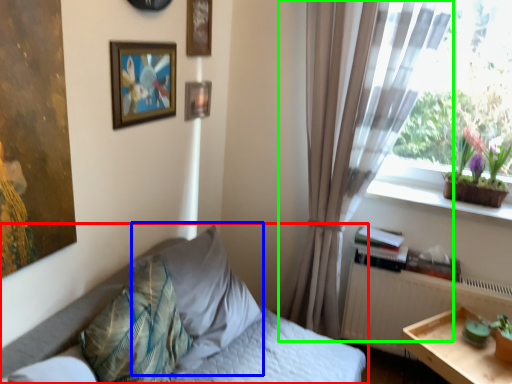
Question: Considering the real-world distances, which object is farthest from bed (highlighted by a red box)? pillow (highlighted by a blue box) or curtain (highlighted by a green box)?

Choices:
 (A) pillow
 (B) curtain

Answer: (B)